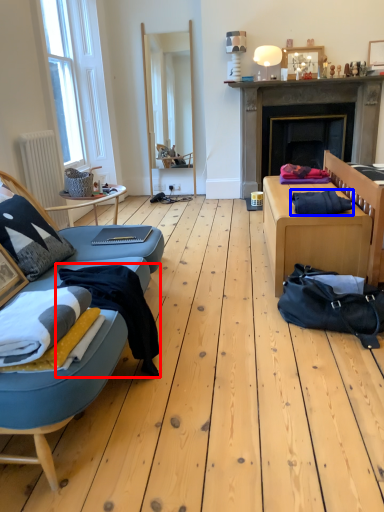
Question: Which object is closer to the camera taking this photo, clothing (highlighted by a red box) or clothing (highlighted by a blue box)?

Choices:
 (A) clothing
 (B) clothing

Answer: (A)